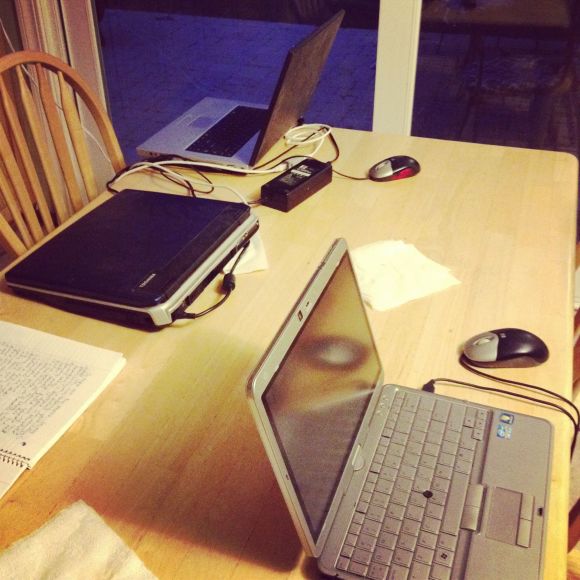
At what (x,y) coordinates should I click in order to perform the action: click on book binder. Please return your answer as a coordinate pair (x, y). This screenshot has height=580, width=580. Looking at the image, I should click on (14, 455).